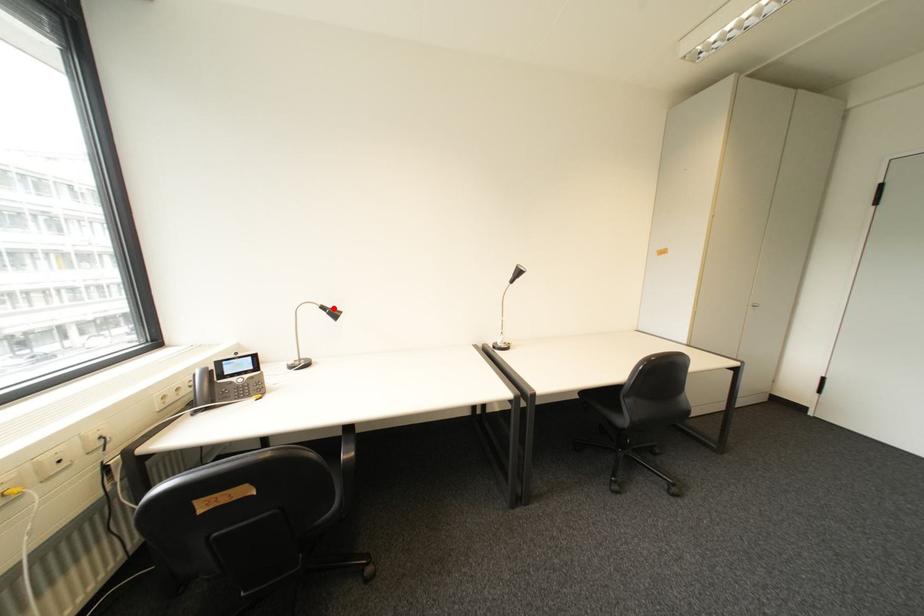
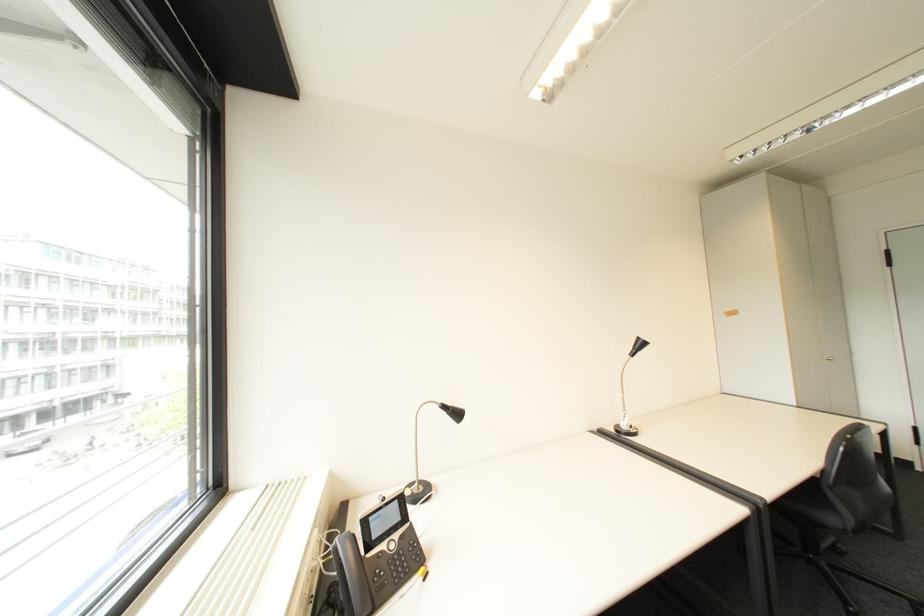
In the second image, find the point that corresponds to the highlighted location in the first image.

(455, 407)